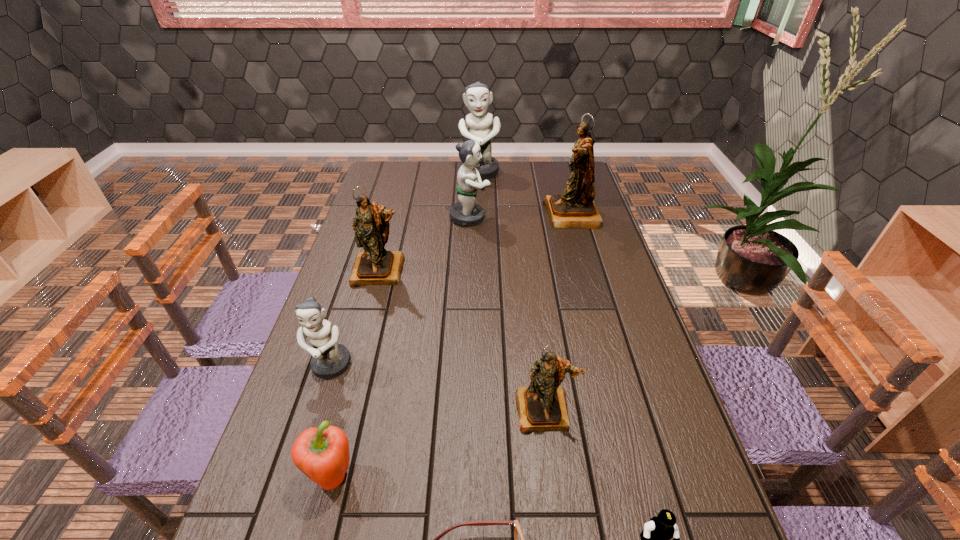
The height and width of the screenshot is (540, 960). What are the coordinates of `the farthest green figurine` in the screenshot? It's located at (477, 97).

The height and width of the screenshot is (540, 960). Identify the location of the biggest green figurine. (477, 97).

Identify the location of the rightmost gold figurine. (575, 208).

At what (x,y) coordinates should I click in order to perform the action: click on the rightmost figurine. Please return your answer as a coordinate pair (x, y). This screenshot has height=540, width=960. Looking at the image, I should click on (575, 208).

Where is `the second nearest green figurine`? the second nearest green figurine is located at coordinates (466, 212).

Locate an element on the screen. The image size is (960, 540). the second nearest gold figurine is located at coordinates (375, 266).

You are a GUI agent. You are given a task and a screenshot of the screen. Output one action in this format:
    pyautogui.click(x=<x>, y=<y>)
    Task: Click on the second biggest gold figurine
    This screenshot has height=540, width=960.
    Given the screenshot: What is the action you would take?
    pyautogui.click(x=375, y=266)

Where is `the nearest gold figurine`? the nearest gold figurine is located at coordinates (542, 406).

Identify the location of the second gold figurine from right to left. (542, 406).

Image resolution: width=960 pixels, height=540 pixels. I want to click on the fifth farthest object, so (x=329, y=359).